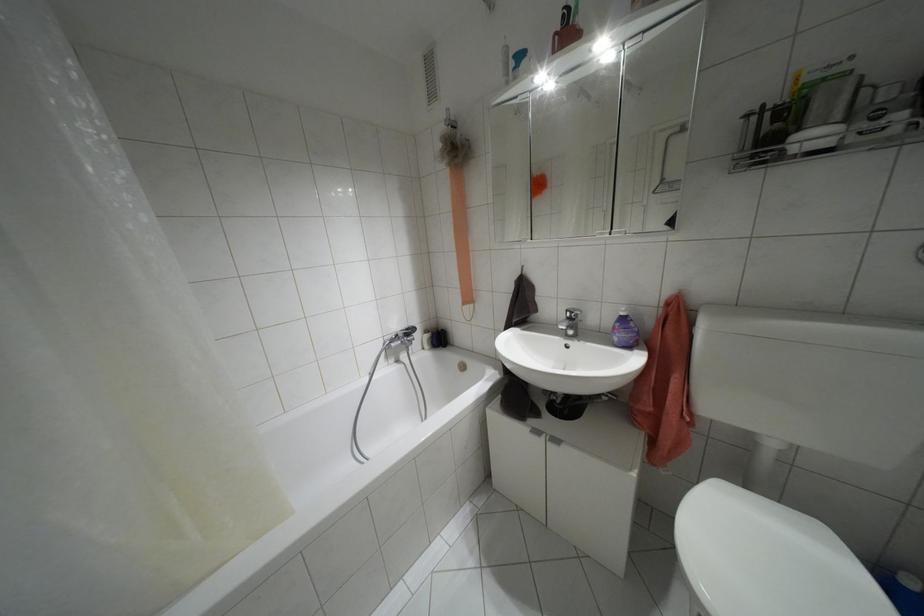
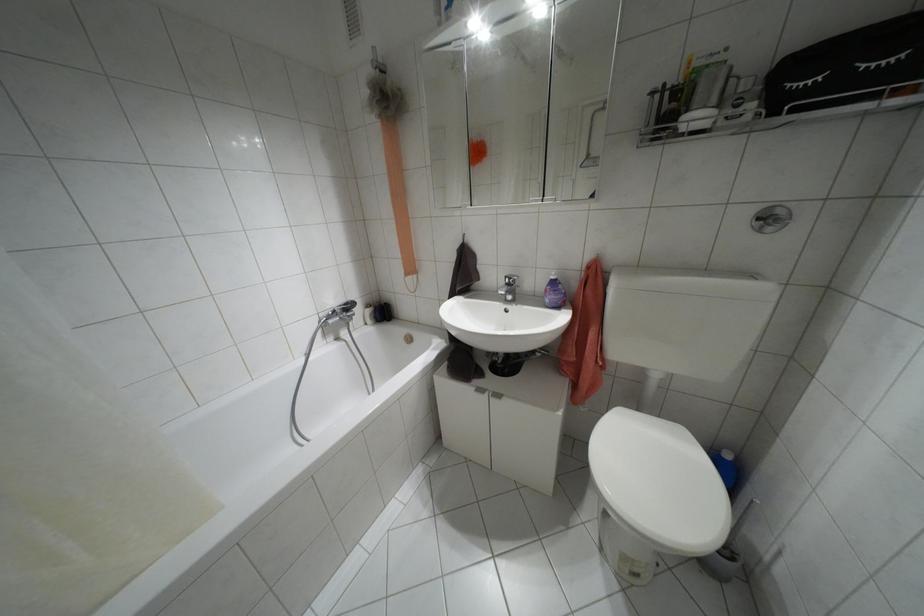
Question: Which direction would the cameraman need to move to produce the second image? Reply with the corresponding letter.

Choices:
 (A) Left
 (B) Right
 (C) Forward
 (D) Backward

Answer: (B)